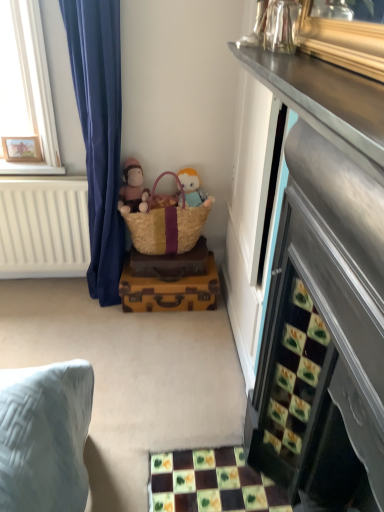
Question: Considering the positions of soft brown plush at lower center and brown woven picnic basket at center in the image, is soft brown plush at lower center taller or shorter than brown woven picnic basket at center?

Choices:
 (A) short
 (B) tall

Answer: (A)

Question: Considering their positions, is soft brown plush at lower center located in front of or behind brown woven picnic basket at center?

Choices:
 (A) behind
 (B) front

Answer: (A)

Question: Which object is the closest to the vintage brown suitcase at center?

Choices:
 (A) brown woven picnic basket at center
 (B) soft plush toy at center
 (C) soft brown plush at lower center

Answer: (A)

Question: Estimate the real-world distances between objects in this image. Which object is farther from the brown woven picnic basket at center?

Choices:
 (A) vintage brown suitcase at center
 (B) soft brown plush at lower center
 (C) soft plush toy at center

Answer: (A)